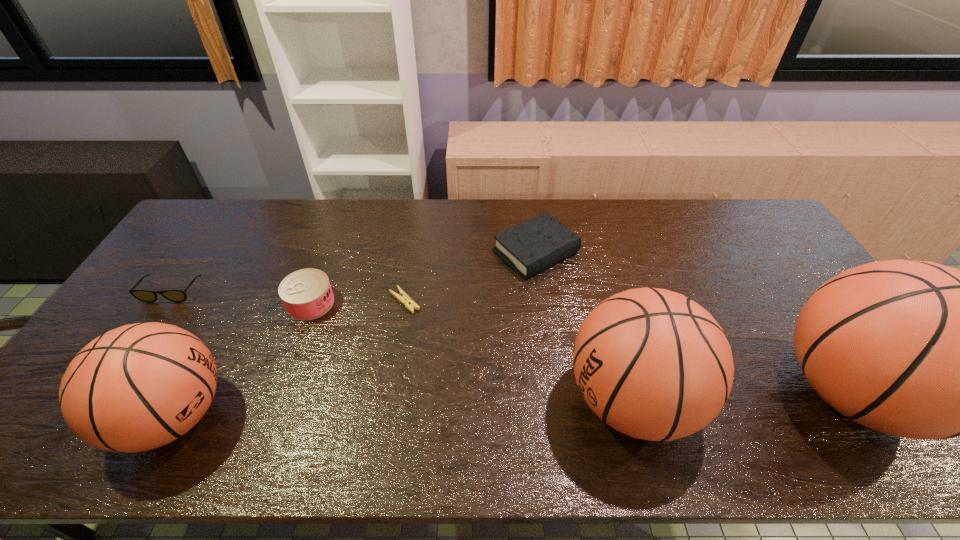
The width and height of the screenshot is (960, 540). I want to click on sunglasses located at the left edge, so click(x=173, y=295).

The height and width of the screenshot is (540, 960). In order to click on object located at the near left corner in this screenshot , I will do `click(138, 387)`.

Identify the location of vacant space at the far edge. The height and width of the screenshot is (540, 960). (269, 216).

Where is `vacant space at the left edge of the desktop`? vacant space at the left edge of the desktop is located at coordinates (199, 281).

Locate an element on the screen. vacant space at the far left corner of the desktop is located at coordinates (247, 208).

You are a GUI agent. You are given a task and a screenshot of the screen. Output one action in this format:
    pyautogui.click(x=<x>, y=<y>)
    Task: Click on the vacant space that's between the shortest basketball and the Bible
    
    Given the screenshot: What is the action you would take?
    pyautogui.click(x=355, y=334)

This screenshot has height=540, width=960. I want to click on vacant area that lies between the fourth tallest object and the Bible, so click(x=423, y=278).

Identify the location of vacant area between the fifth object from right to left and the fourth object from left to right. (358, 302).

Locate an element on the screen. The width and height of the screenshot is (960, 540). free space between the fifth object from right to left and the sunglasses is located at coordinates (241, 297).

Where is `object that stands as the second closest to the sixth tallest object`? object that stands as the second closest to the sixth tallest object is located at coordinates (306, 294).